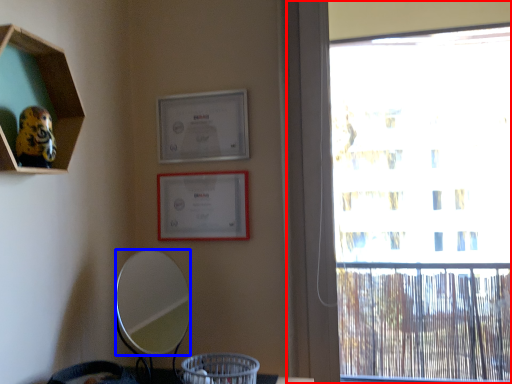
Question: Which object is closer to the camera taking this photo, window (highlighted by a red box) or mirror (highlighted by a blue box)?

Choices:
 (A) window
 (B) mirror

Answer: (B)